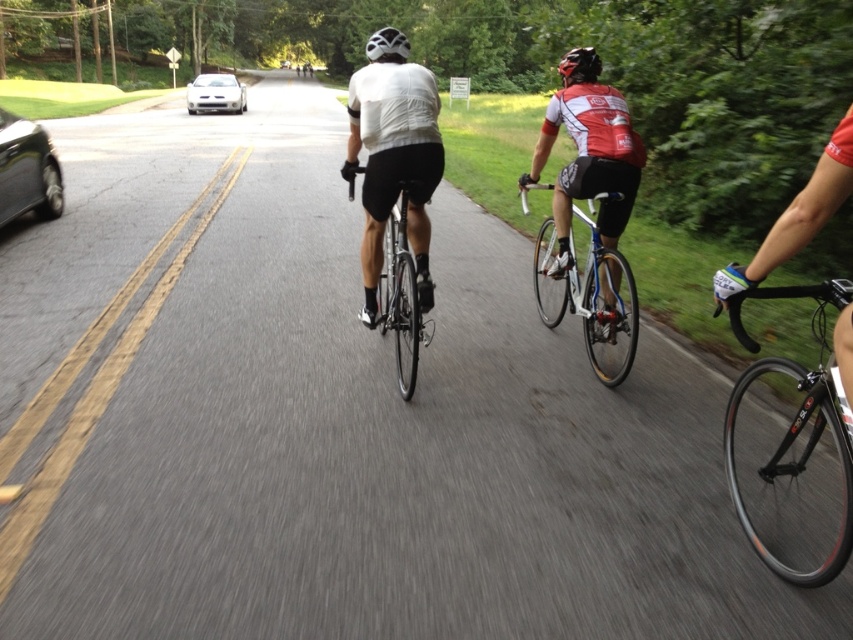
You are a cyclist approaching a road with a shiny black car at left and a black matte helmet at upper center. Which object is located to the left of the other?

The shiny black car at left is positioned on the left side of black matte helmet at upper center.

You are a cyclist approaching the road and see the white matte jersey at center and the shiny black bike at center. Which object is positioned to the right?

The shiny black bike at center is positioned to the right of the white matte jersey at center.